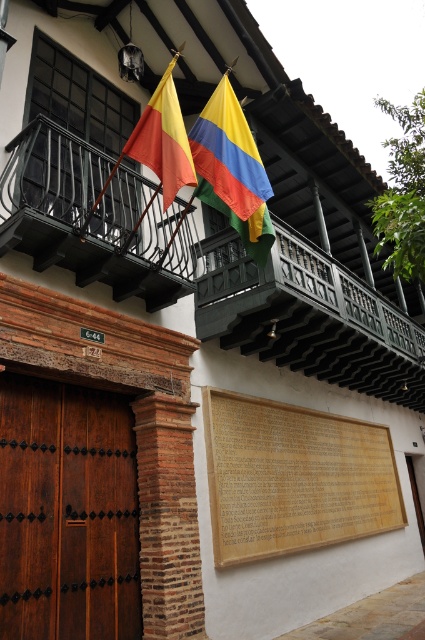
You are standing in front of the colonial building. There is a point marked at coordinates (294,477). What object is located at that point?

The point at (294,477) corresponds to the wooden plaque at center.